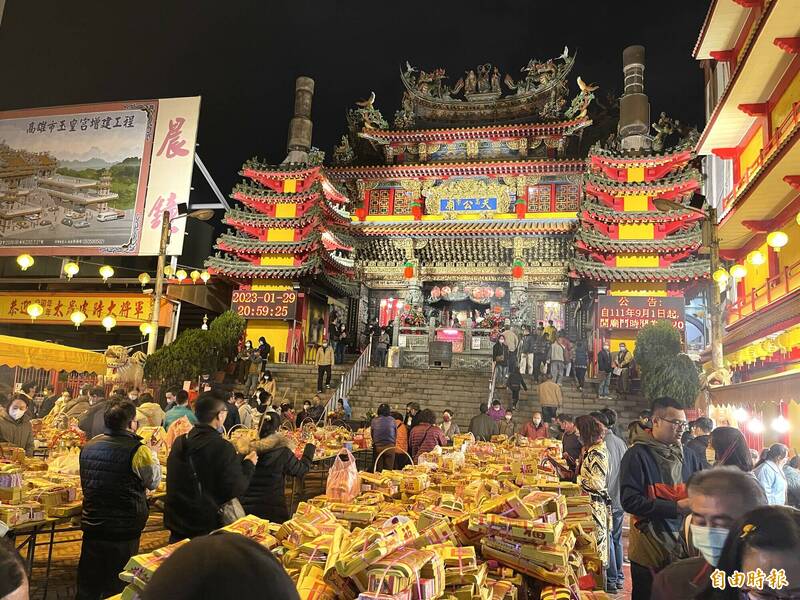
Image resolution: width=800 pixels, height=600 pixels. What are the coordinates of `digital signs` in the screenshot? It's located at (290, 307), (610, 301).